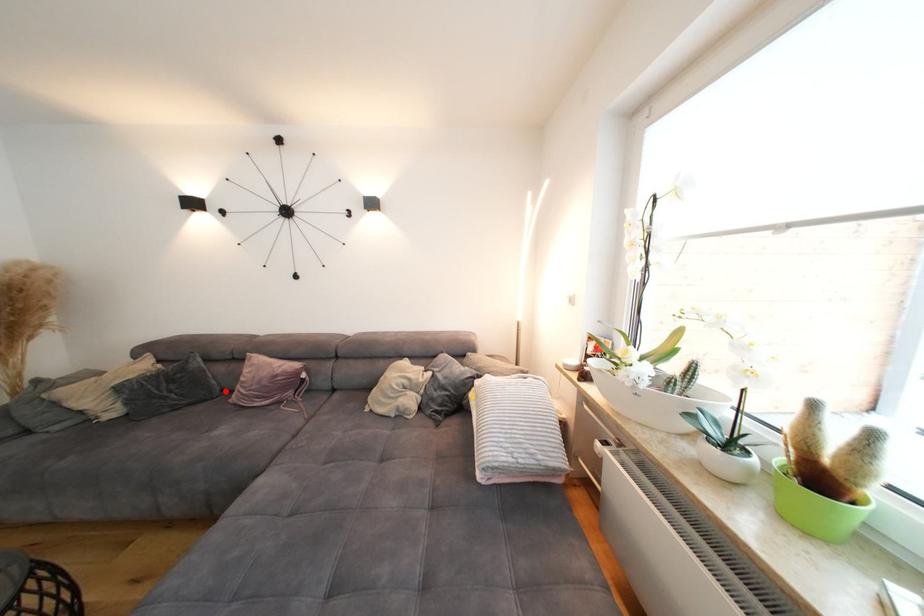
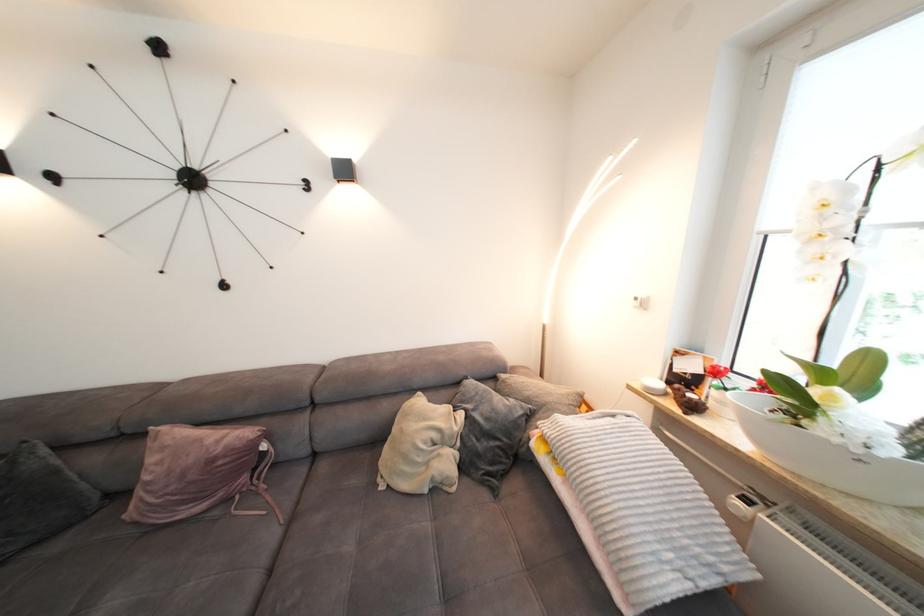
Where in the second image is the point corresponding to the highlighted location from the first image?

(103, 498)